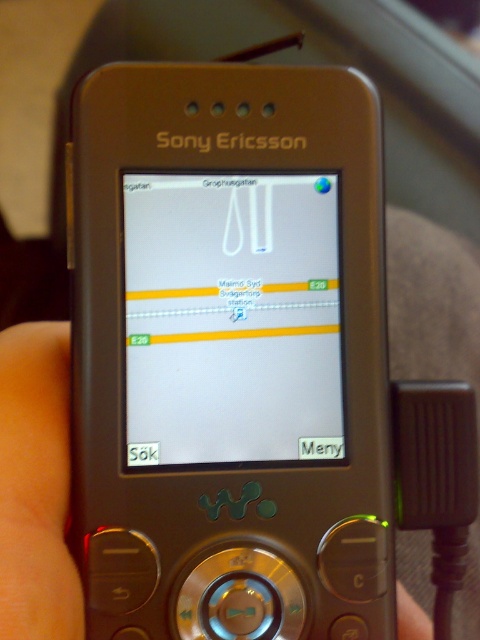
You are holding the metallic silver phone at center and want to check the map on the matte silver screen at center. Can you tell me if the screen is narrower than the phone itself?

The matte silver screen at center has a lesser width compared to the metallic silver phone at center, so yes, the matte silver screen at center is narrower than the metallic silver phone at center.

You are holding the Sony Ericsson phone and looking at the screen. Which part is closer to your eyes, the matte silver screen at center or the metallic silver phone at center?

The matte silver screen at center is closer to your eyes because it is further to the viewer than the metallic silver phone at center.